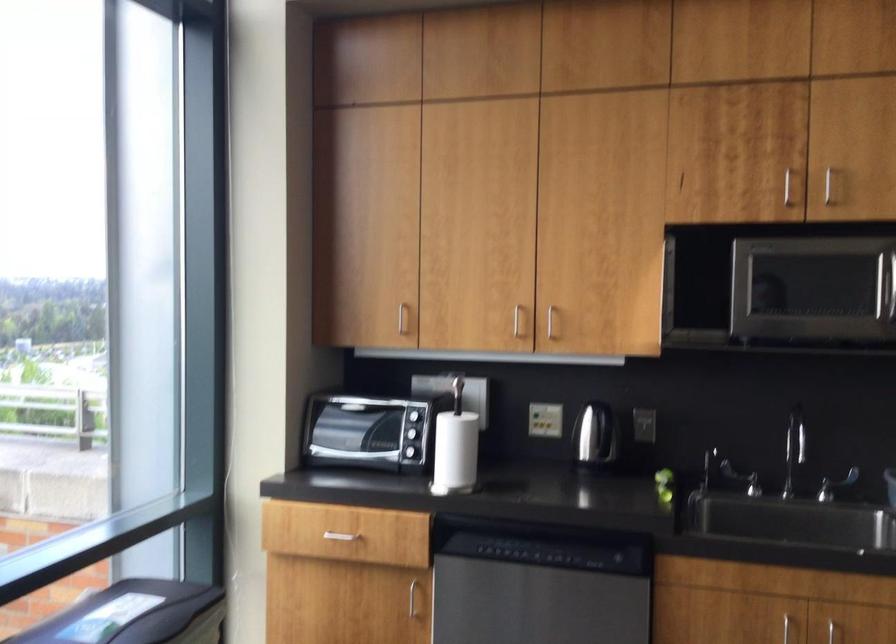
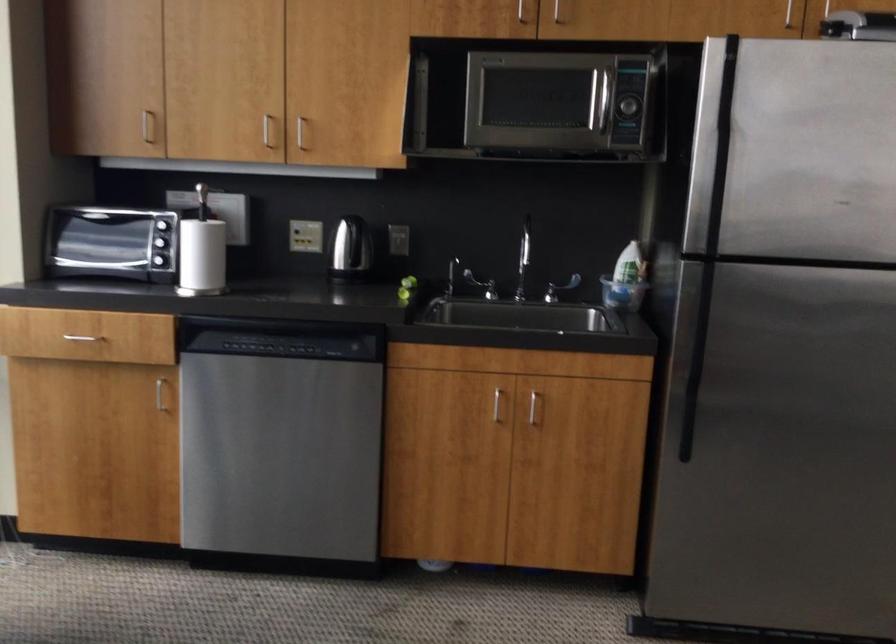
Locate, in the second image, the point that corresponds to point 401,323 in the first image.

(147, 126)